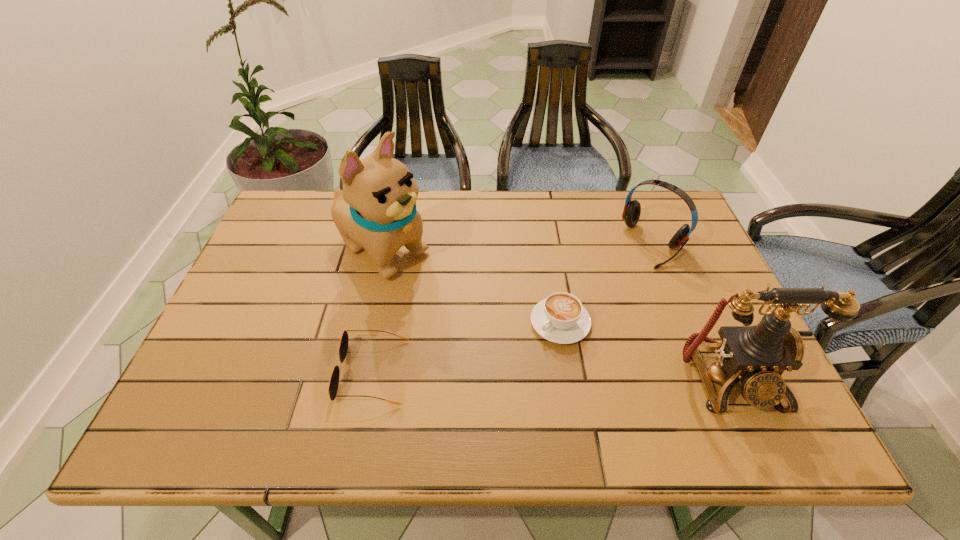
Locate an element on the screen. This screenshot has height=540, width=960. blank region between the sunglasses and the headset is located at coordinates (513, 307).

Locate an element on the screen. The image size is (960, 540). free space between the second tallest object and the third shortest object is located at coordinates (692, 310).

The image size is (960, 540). What are the coordinates of `free space between the second tallest object and the headset` in the screenshot? It's located at (692, 310).

Identify the location of vacant area that lies between the sunglasses and the puppy. The height and width of the screenshot is (540, 960). (377, 312).

Where is `vacant region between the sunglasses and the third object from left to right`? vacant region between the sunglasses and the third object from left to right is located at coordinates (467, 347).

You are a GUI agent. You are given a task and a screenshot of the screen. Output one action in this format:
    pyautogui.click(x=<x>, y=<y>)
    Task: Click on the free area in between the fourth shortest object and the third shortest object
    The height and width of the screenshot is (540, 960).
    Given the screenshot: What is the action you would take?
    pyautogui.click(x=692, y=310)

Locate an element on the screen. The image size is (960, 540). empty location between the fourth shortest object and the third tallest object is located at coordinates (692, 310).

Identify which object is the third nearest to the headset. Please provide its 2D coordinates. Your answer should be formatted as a tuple, i.e. [(x, y)], where the tuple contains the x and y coordinates of a point satisfying the conditions above.

[(376, 210)]

Select which object is the second closest to the third tallest object. Please provide its 2D coordinates. Your answer should be formatted as a tuple, i.e. [(x, y)], where the tuple contains the x and y coordinates of a point satisfying the conditions above.

[(758, 355)]

Find the location of a particular element. The width and height of the screenshot is (960, 540). vacant area in the image that satisfies the following two spatial constraints: 1. on the back side of the third shortest object; 2. on the left side of the third object from right to left is located at coordinates (547, 243).